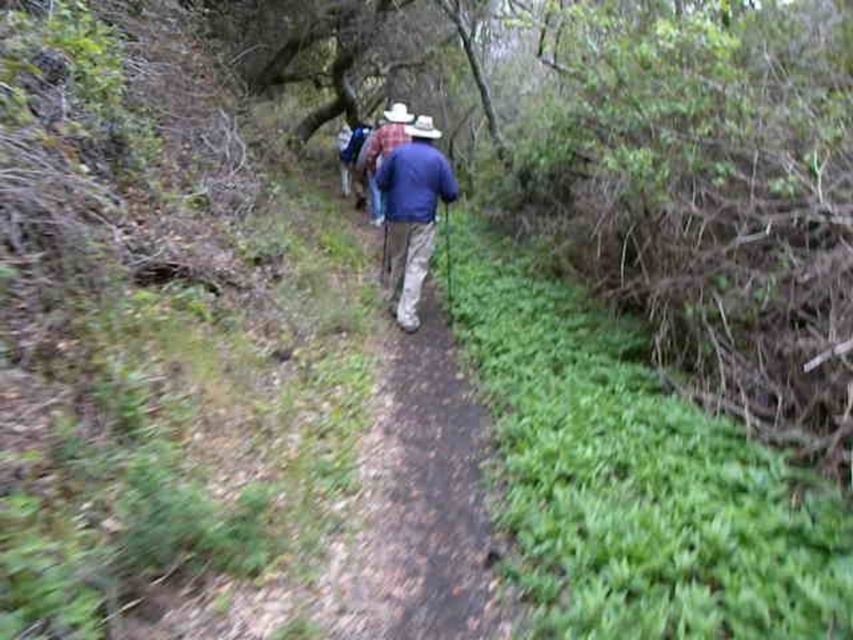
Question: Among these points, which one is nearest to the camera?

Choices:
 (A) (416, 186)
 (B) (401, 461)

Answer: (B)

Question: Does brown dirt path at center appear on the left side of blue fabric jacket at center?

Choices:
 (A) no
 (B) yes

Answer: (A)

Question: Is brown dirt path at center smaller than blue fabric jacket at center?

Choices:
 (A) no
 (B) yes

Answer: (A)

Question: Which point appears closest to the camera in this image?

Choices:
 (A) (480, 480)
 (B) (432, 195)

Answer: (A)

Question: Observing the image, what is the correct spatial positioning of brown dirt path at center in reference to blue fabric jacket at center?

Choices:
 (A) right
 (B) left

Answer: (A)

Question: Among these points, which one is farthest from the camera?

Choices:
 (A) (380, 532)
 (B) (405, 305)

Answer: (B)